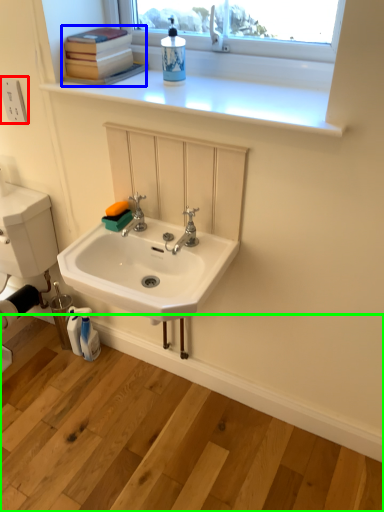
Question: Which object is the farthest from electric outlet (highlighted by a red box)? Choose among these: book (highlighted by a blue box) or counter (highlighted by a green box).

Choices:
 (A) book
 (B) counter

Answer: (B)